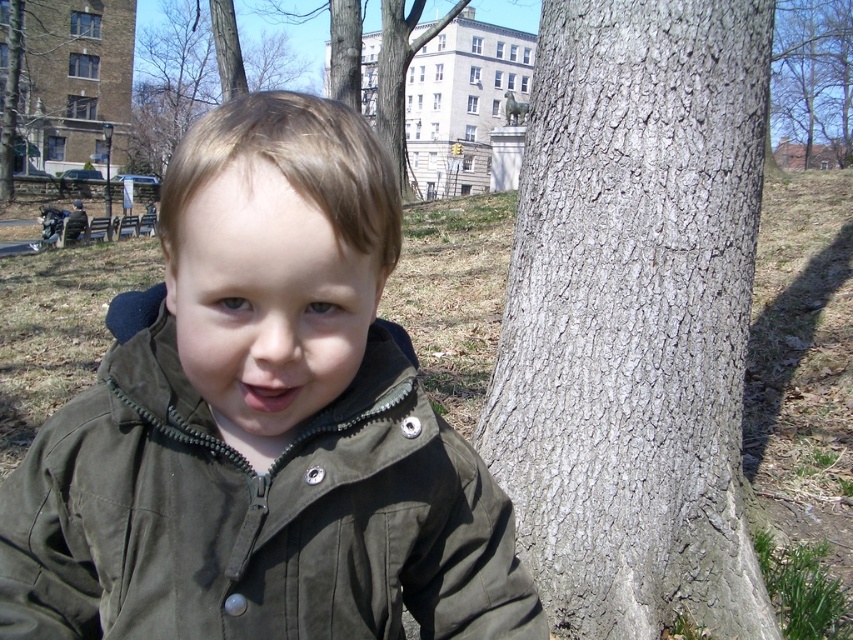
Question: Is smooth bark tree at upper right closer to the viewer compared to brown rough bark tree at upper left?

Choices:
 (A) yes
 (B) no

Answer: (A)

Question: Which object appears farthest from the camera in this image?

Choices:
 (A) olive green fabric jacket at lower left
 (B) smooth bark tree at upper right
 (C) gray rough bark at center
 (D) brown rough bark tree at upper left

Answer: (D)

Question: Is gray rough bark at center wider than brown rough bark tree at upper left?

Choices:
 (A) no
 (B) yes

Answer: (A)

Question: Considering the relative positions of olive green fabric jacket at lower left and brown rough bark tree at upper left in the image provided, where is olive green fabric jacket at lower left located with respect to brown rough bark tree at upper left?

Choices:
 (A) left
 (B) right

Answer: (B)

Question: Among these points, which one is nearest to the camera?

Choices:
 (A) (0, 176)
 (B) (671, 173)

Answer: (B)

Question: Which point is farther to the camera?

Choices:
 (A) (514, 333)
 (B) (257, 604)
 (C) (1, 193)
 (D) (788, 134)

Answer: (D)